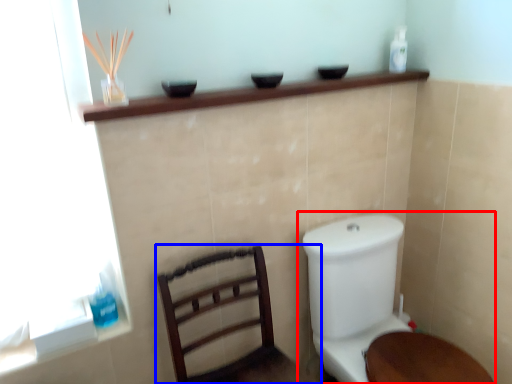
Question: Which of the following is the closest to the observer, toilet (highlighted by a red box) or furniture (highlighted by a blue box)?

Choices:
 (A) toilet
 (B) furniture

Answer: (B)